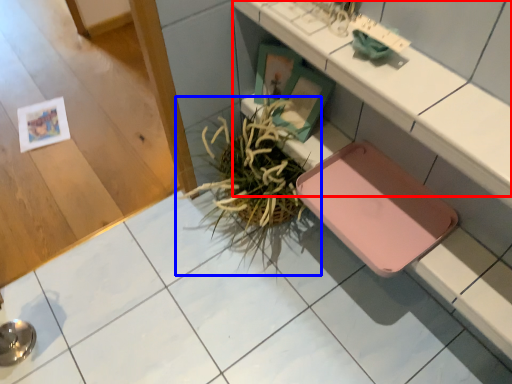
Question: Which object is closer to the camera taking this photo, counter (highlighted by a red box) or houseplant (highlighted by a blue box)?

Choices:
 (A) counter
 (B) houseplant

Answer: (A)